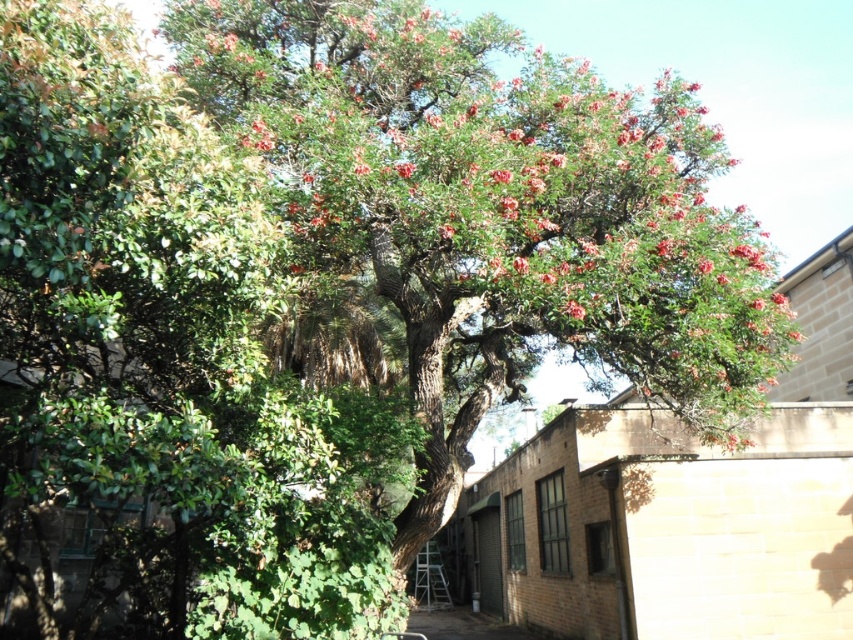
Describe the element at coordinates (157, 371) in the screenshot. The height and width of the screenshot is (640, 853). I see `green leafy tree at upper left` at that location.

Between point (172, 256) and point (273, 49), which one is positioned behind?

Positioned behind is point (273, 49).

What are the coordinates of `green leafy tree at upper left` in the screenshot? It's located at (157, 371).